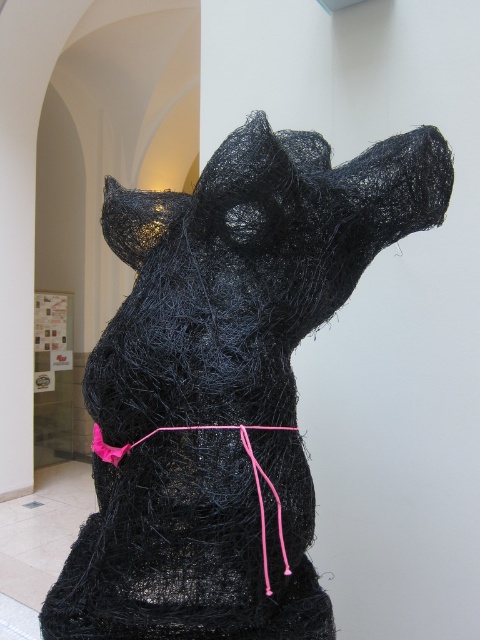
Who is lower down, black wire mesh dog at center or pink fabric string at center?

pink fabric string at center is lower down.

Can you confirm if black wire mesh dog at center is positioned to the right of pink fabric string at center?

In fact, black wire mesh dog at center is to the left of pink fabric string at center.

The image size is (480, 640). Describe the element at coordinates (226, 381) in the screenshot. I see `black wire mesh dog at center` at that location.

Where is `black wire mesh dog at center`? black wire mesh dog at center is located at coordinates (226, 381).